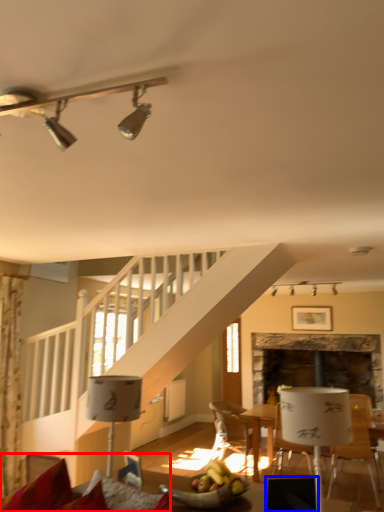
Question: Among these objects, which one is farthest to the camera, couch (highlighted by a red box) or armchair (highlighted by a blue box)?

Choices:
 (A) couch
 (B) armchair

Answer: (B)